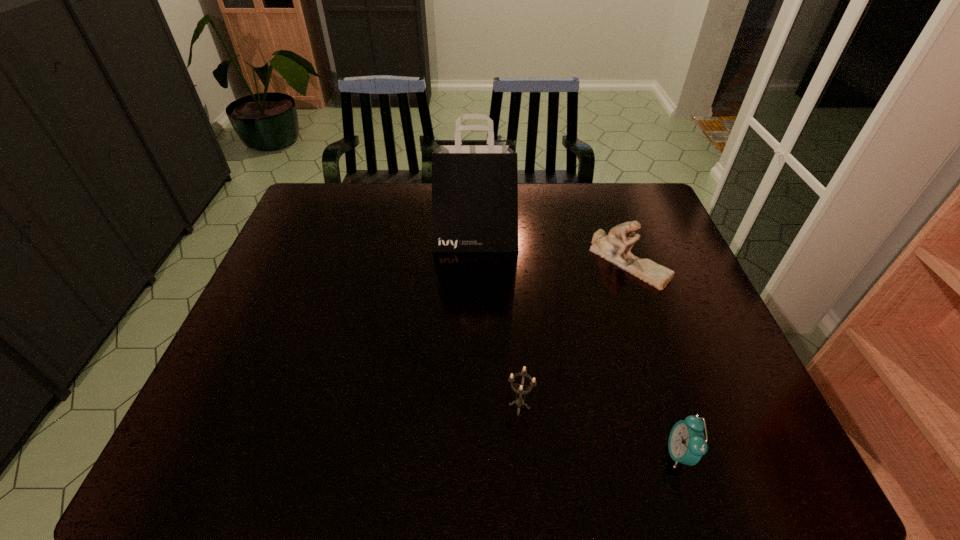
Where is `free spot that satisfies the following two spatial constraints: 1. on the front with handles of the tallest object; 2. on the left side of the second nearest object`? free spot that satisfies the following two spatial constraints: 1. on the front with handles of the tallest object; 2. on the left side of the second nearest object is located at coordinates (473, 406).